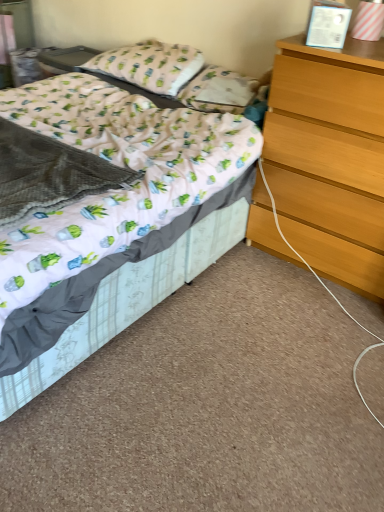
Question: Should I look upward or downward to see light brown wooden chest of drawers at right?

Choices:
 (A) up
 (B) down

Answer: (A)

Question: Is white fabric pillow at upper center, the second pillow viewed from the right, with white fabric pillow at center, the 1th pillow in the right-to-left sequence?

Choices:
 (A) yes
 (B) no

Answer: (B)

Question: Is white fabric pillow at upper center, the first pillow viewed from the left, completely or partially outside of white fabric pillow at center, positioned as the second pillow in left-to-right order?

Choices:
 (A) no
 (B) yes

Answer: (B)

Question: Considering the relative positions of white fabric pillow at upper center, the second pillow viewed from the right, and white fabric pillow at center, positioned as the second pillow in left-to-right order, in the image provided, is white fabric pillow at upper center, the second pillow viewed from the right, to the right of white fabric pillow at center, positioned as the second pillow in left-to-right order, from the viewer's perspective?

Choices:
 (A) yes
 (B) no

Answer: (B)

Question: Considering the relative sizes of white fabric pillow at upper center, the first pillow viewed from the left, and white fabric pillow at center, positioned as the second pillow in left-to-right order, in the image provided, is white fabric pillow at upper center, the first pillow viewed from the left, bigger than white fabric pillow at center, positioned as the second pillow in left-to-right order,?

Choices:
 (A) yes
 (B) no

Answer: (A)

Question: Can white fabric pillow at center, positioned as the second pillow in left-to-right order, be found inside white fabric pillow at upper center, the second pillow viewed from the right?

Choices:
 (A) no
 (B) yes

Answer: (A)

Question: Is white fabric pillow at upper center, the second pillow viewed from the right, wider than white fabric pillow at center, positioned as the second pillow in left-to-right order?

Choices:
 (A) no
 (B) yes

Answer: (B)

Question: Is white fabric bed at center wider than white fabric pillow at upper center, the second pillow viewed from the right?

Choices:
 (A) yes
 (B) no

Answer: (A)

Question: Can you confirm if white fabric bed at center is shorter than white fabric pillow at upper center, the first pillow viewed from the left?

Choices:
 (A) no
 (B) yes

Answer: (A)

Question: Is white fabric bed at center smaller than white fabric pillow at upper center, the second pillow viewed from the right?

Choices:
 (A) no
 (B) yes

Answer: (A)

Question: From a real-world perspective, is white fabric bed at center on white fabric pillow at upper center, the second pillow viewed from the right?

Choices:
 (A) yes
 (B) no

Answer: (B)

Question: From the image's perspective, does white fabric bed at center appear higher than white fabric pillow at upper center, the second pillow viewed from the right?

Choices:
 (A) yes
 (B) no

Answer: (B)

Question: Does white fabric bed at center turn towards white fabric pillow at upper center, the first pillow viewed from the left?

Choices:
 (A) yes
 (B) no

Answer: (B)

Question: From a real-world perspective, is white fabric pillow at upper center, the first pillow viewed from the left, on top of light brown wooden chest of drawers at right?

Choices:
 (A) yes
 (B) no

Answer: (A)